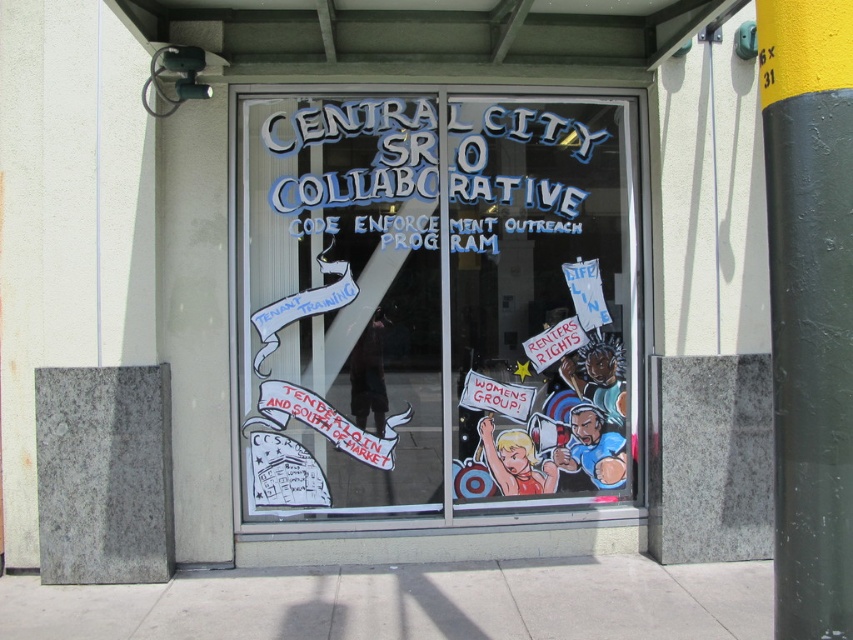
Question: Which of the following is the farthest from the observer?

Choices:
 (A) transparent glass window at center
 (B) yellow-green painted pole at right

Answer: (A)

Question: Which of the following is the closest to the observer?

Choices:
 (A) transparent glass window at center
 (B) yellow-green painted pole at right

Answer: (B)

Question: Is transparent glass window at center behind yellow-green painted pole at right?

Choices:
 (A) yes
 (B) no

Answer: (A)

Question: Is transparent glass window at center to the right of yellow-green painted pole at right from the viewer's perspective?

Choices:
 (A) no
 (B) yes

Answer: (A)

Question: Does transparent glass window at center appear on the left side of yellow-green painted pole at right?

Choices:
 (A) no
 (B) yes

Answer: (B)